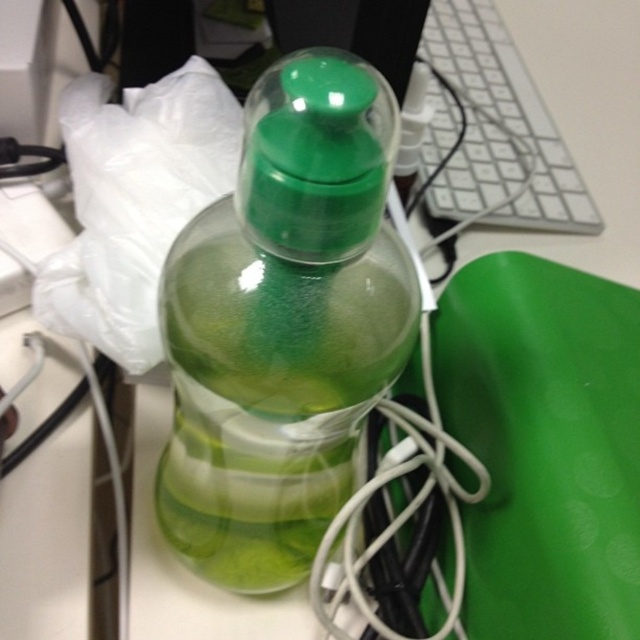
Between transparent plastic bottle at center and white plastic keyboard at upper right, which one appears on the left side from the viewer's perspective?

transparent plastic bottle at center is more to the left.

Does point (211, 468) come behind point (538, 108)?

No, it is in front of (538, 108).

Between point (196, 483) and point (509, 36), which one is positioned behind?

The point (509, 36) is behind.

Image resolution: width=640 pixels, height=640 pixels. What are the coordinates of `transparent plastic bottle at center` in the screenshot? It's located at (284, 324).